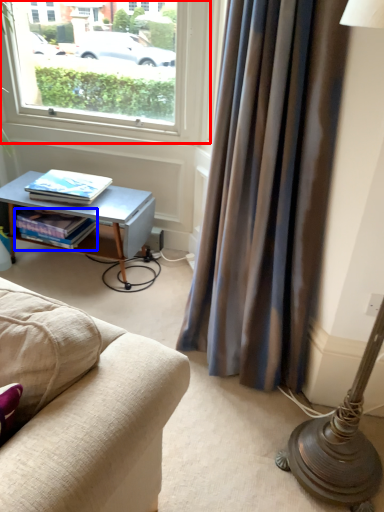
Question: Which point is further to the camera, window (highlighted by a red box) or book (highlighted by a blue box)?

Choices:
 (A) window
 (B) book

Answer: (B)